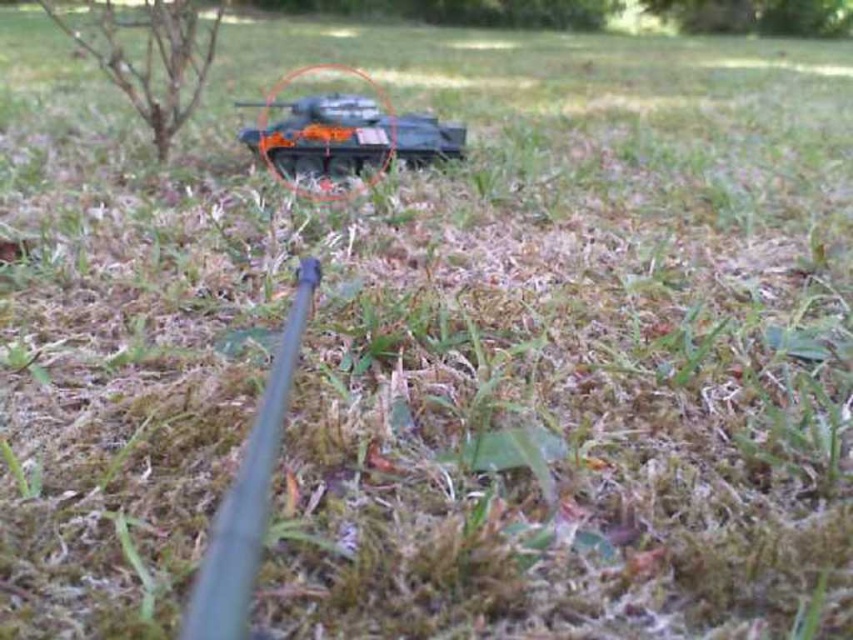
Does orange matte tank at center have a lesser height compared to brown rough tree at upper left?

Yes.

Who is positioned more to the right, orange matte tank at center or brown rough tree at upper left?

From the viewer's perspective, orange matte tank at center appears more on the right side.

You are a GUI agent. You are given a task and a screenshot of the screen. Output one action in this format:
    pyautogui.click(x=<x>, y=<y>)
    Task: Click on the orange matte tank at center
    This screenshot has width=853, height=640.
    Given the screenshot: What is the action you would take?
    pyautogui.click(x=344, y=132)

Describe the element at coordinates (248, 493) in the screenshot. I see `metallic gray gun at center` at that location.

Does point (273, 371) lie behind point (154, 74)?

No, (273, 371) is in front of (154, 74).

The height and width of the screenshot is (640, 853). What are the coordinates of `metallic gray gun at center` in the screenshot? It's located at (248, 493).

Between orange matte tank at center and metallic gray gun at center, which one appears on the left side from the viewer's perspective?

From the viewer's perspective, orange matte tank at center appears more on the left side.

Is orange matte tank at center wider than metallic gray gun at center?

Yes, orange matte tank at center is wider than metallic gray gun at center.

Between point (334, 134) and point (229, 563), which one is positioned behind?

The point (334, 134) is more distant.

Locate an element on the screen. The width and height of the screenshot is (853, 640). orange matte tank at center is located at coordinates (344, 132).